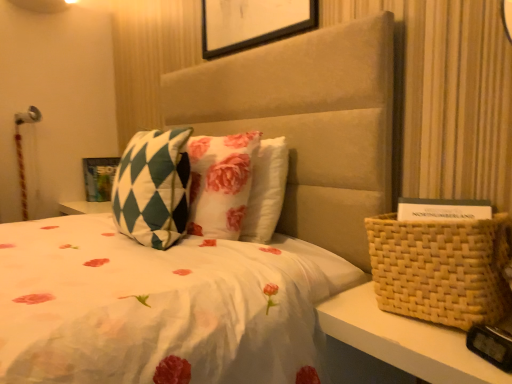
Question: In terms of height, does woven beige basket at right look taller or shorter compared to matte green and white checkered picture frame at upper left?

Choices:
 (A) short
 (B) tall

Answer: (A)

Question: Is woven beige basket at right bigger or smaller than matte green and white checkered picture frame at upper left?

Choices:
 (A) big
 (B) small

Answer: (A)

Question: Which of these objects is positioned farthest from the green checkered pillow at center?

Choices:
 (A) woven beige basket at right
 (B) matte green and white checkered picture frame at upper left

Answer: (B)

Question: Which object is the closest to the woven beige basket at right?

Choices:
 (A) matte green and white checkered picture frame at upper left
 (B) green checkered pillow at center

Answer: (B)